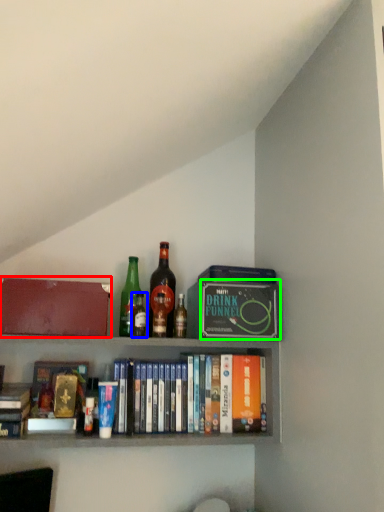
Question: Considering the real-world distances, which object is farthest from box (highlighted by a red box)? bottle (highlighted by a blue box) or paperback book (highlighted by a green box)?

Choices:
 (A) bottle
 (B) paperback book

Answer: (B)